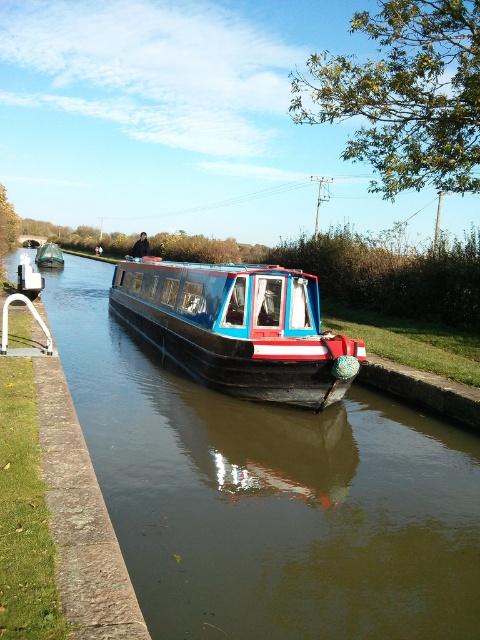
You are a photographer planning to take a picture of the brown wooden boat at center and the matte black boat at center in the canal scene. Since you want both boats to be clearly visible in your photo, which boat should you focus on first to ensure proper depth of field?

The brown wooden boat at center is located below the matte black boat at center, so you should focus on the matte black boat at center first to ensure both are in focus.

You are standing at the camera position and want to reach the point at coordinates (272, 330) in the canal scene. If your maximum reach is 10 meters, can you safely reach it without moving closer?

The point at coordinates (272, 330) is 10.71 meters away from the camera, which exceeds your maximum reach of 10 meters. Therefore, you cannot safely reach it without moving closer.